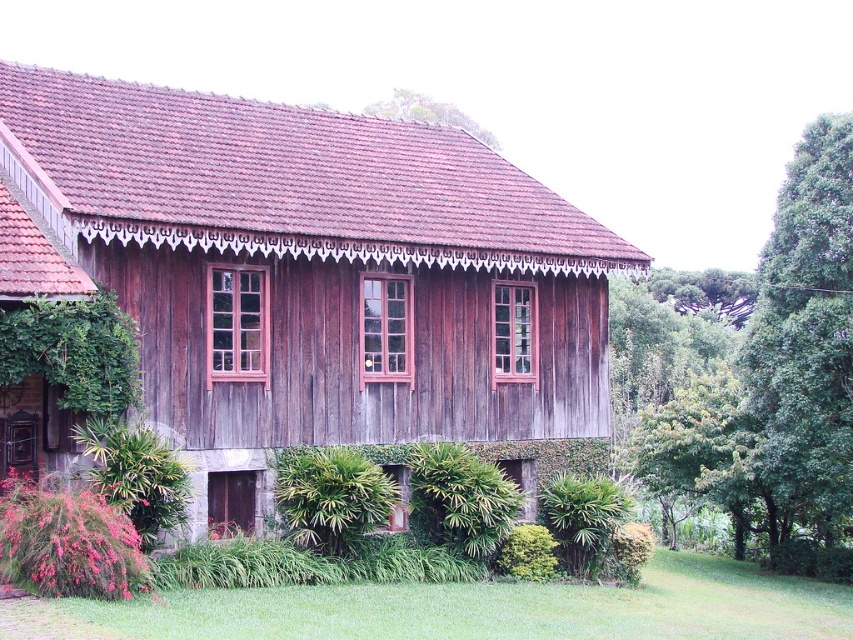
Does weathered wood house at center lie behind green leafy plant at lower center?

No.

Does weathered wood house at center have a larger size compared to green leafy plant at lower center?

Correct, weathered wood house at center is larger in size than green leafy plant at lower center.

Who is more forward, (418,339) or (347,500)?

Point (347,500) is more forward.

Find the location of a particular element. weathered wood house at center is located at coordinates (310, 276).

In the scene shown: Is green leafy tree at right bigger than green leafy tree at upper center?

Yes.

Which of these two, green leafy tree at right or green leafy tree at upper center, stands taller?

green leafy tree at right

Which is behind, point (782, 524) or point (432, 113)?

Point (432, 113)

Where is `green leafy tree at right`? green leafy tree at right is located at coordinates (776, 381).

Can you confirm if green leafy tree at right is wider than green leafy plant at lower center?

Yes.

Is point (846, 164) farther from camera compared to point (328, 550)?

Yes, point (846, 164) is behind point (328, 550).

The width and height of the screenshot is (853, 640). In order to click on green leafy tree at right in this screenshot , I will do `click(776, 381)`.